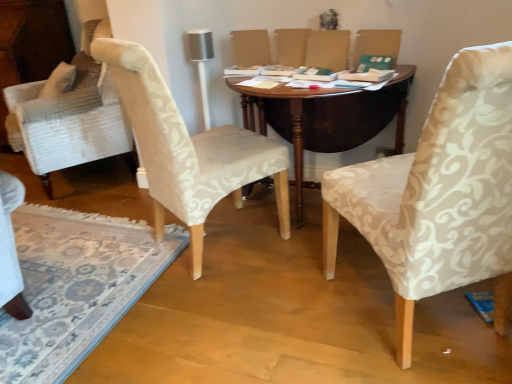
Question: Considering the relative sizes of white textured fabric chair at left, which appears as the 2th chair when viewed from the right, and dark wood table at center in the image provided, is white textured fabric chair at left, which appears as the 2th chair when viewed from the right, taller than dark wood table at center?

Choices:
 (A) no
 (B) yes

Answer: (B)

Question: From the image's perspective, is white textured fabric chair at left, which appears as the 2th chair when viewed from the right, located beneath dark wood table at center?

Choices:
 (A) no
 (B) yes

Answer: (B)

Question: From a real-world perspective, is white textured fabric chair at left, which appears as the 2th chair when viewed from the right, located beneath dark wood table at center?

Choices:
 (A) yes
 (B) no

Answer: (B)

Question: Considering the relative positions of white textured fabric chair at left, the 1th chair viewed from the left, and dark wood table at center in the image provided, is white textured fabric chair at left, the 1th chair viewed from the left, to the right of dark wood table at center from the viewer's perspective?

Choices:
 (A) no
 (B) yes

Answer: (A)

Question: Can you confirm if white textured fabric chair at left, the 1th chair viewed from the left, is thinner than dark wood table at center?

Choices:
 (A) no
 (B) yes

Answer: (B)

Question: In terms of height, does white textured fabric chair at left, the 1th chair viewed from the left, look taller or shorter compared to patterned fabric rug at lower left?

Choices:
 (A) tall
 (B) short

Answer: (A)

Question: Considering the positions of point (234, 168) and point (75, 251), is point (234, 168) closer or farther from the camera than point (75, 251)?

Choices:
 (A) closer
 (B) farther

Answer: (A)

Question: Considering the positions of white textured fabric chair at left, the 1th chair viewed from the left, and patterned fabric rug at lower left in the image, is white textured fabric chair at left, the 1th chair viewed from the left, bigger or smaller than patterned fabric rug at lower left?

Choices:
 (A) big
 (B) small

Answer: (B)

Question: From a real-world perspective, relative to patterned fabric rug at lower left, is white textured fabric chair at left, the 1th chair viewed from the left, vertically above or below?

Choices:
 (A) below
 (B) above

Answer: (B)

Question: In the image, is beige damask chair at right, which ranks as the first chair in right-to-left order, on the left side or the right side of dark wood table at center?

Choices:
 (A) left
 (B) right

Answer: (B)

Question: From the image's perspective, is beige damask chair at right, which is the 2th chair from left to right, positioned above or below dark wood table at center?

Choices:
 (A) above
 (B) below

Answer: (B)

Question: Is point coord(387,220) closer or farther from the camera than point coord(263,107)?

Choices:
 (A) farther
 (B) closer

Answer: (B)

Question: Which is correct: beige damask chair at right, which ranks as the first chair in right-to-left order, is inside dark wood table at center, or outside of it?

Choices:
 (A) inside
 (B) outside

Answer: (B)

Question: In the image, is white textured fabric chair at left, the 1th chair viewed from the left, positioned in front of or behind beige damask chair at right, which ranks as the first chair in right-to-left order?

Choices:
 (A) front
 (B) behind

Answer: (B)

Question: Would you say white textured fabric chair at left, which appears as the 2th chair when viewed from the right, is inside or outside beige damask chair at right, which is the 2th chair from left to right?

Choices:
 (A) outside
 (B) inside

Answer: (A)